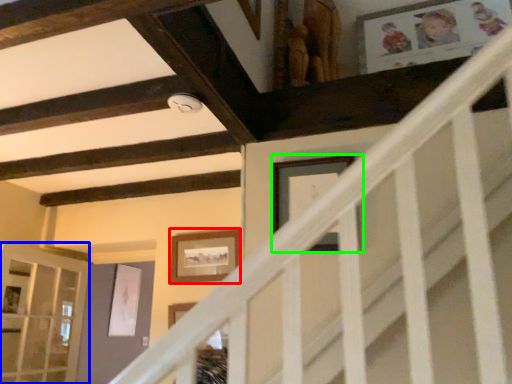
Question: Which object is positioned closest to picture frame (highlighted by a red box)? Select from glass door (highlighted by a blue box) and picture frame (highlighted by a green box).

Choices:
 (A) glass door
 (B) picture frame

Answer: (B)